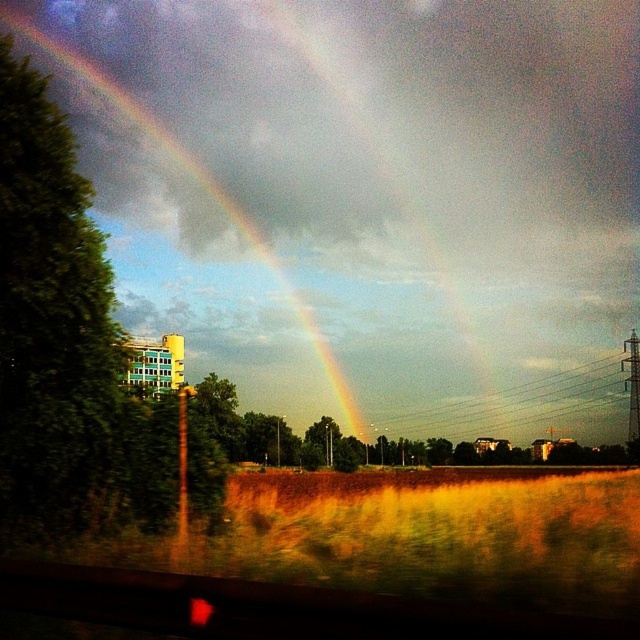
You are a photographer trying to capture both the rainbow at left and the metallic wire at center in a single frame. Based on their positions, which object should you adjust your camera to focus on first to ensure both are in the shot?

The rainbow at left is to the left of metallic wire at center, so you should focus on the metallic wire at center first to ensure both are captured in the frame.

You are standing at the center of the image and want to walk towards the point labeled as point (496, 420). As you move forward, will the point labeled point (136, 108) come into your line of sight?

Since point (136, 108) is behind point (496, 420), moving towards point (496, 420) would mean that point (136, 108) would be obscured and not come into your line of sight.

You are standing in the scene and see a point marked at coordinates (205, 193). Based on the description, can you determine which object this point is located on?

The point at coordinates (205, 193) is located on the rainbow at left.